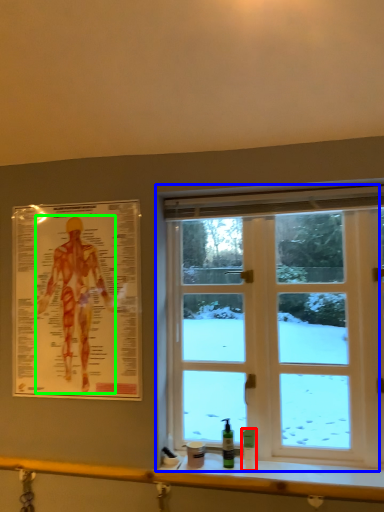
Question: Which object is the farthest from toiletry (highlighted by a red box)? Choose among these: window (highlighted by a blue box) or person (highlighted by a green box).

Choices:
 (A) window
 (B) person

Answer: (B)